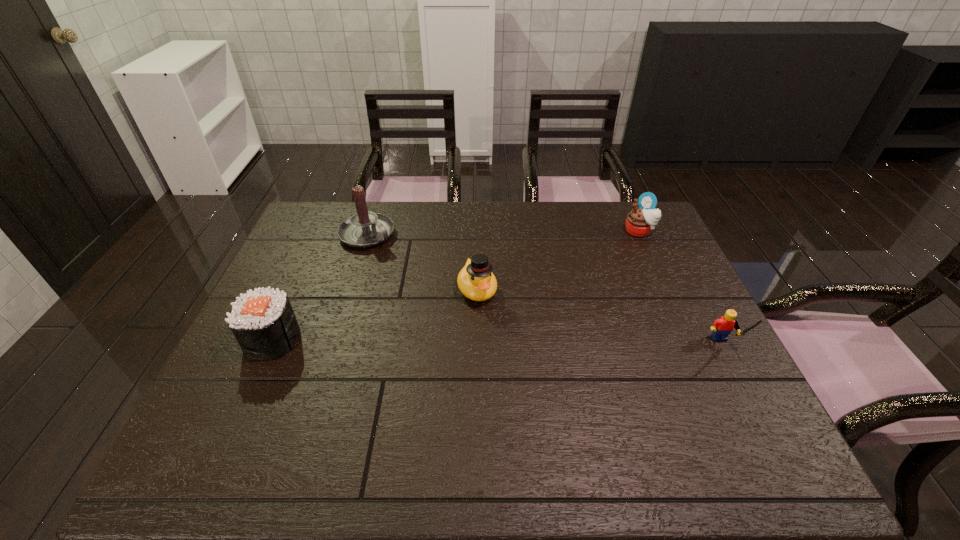
Identify the location of free space on the desktop that is between the sushi and the Lego and is positioned on the front-facing side of the muffin. (530, 343).

I want to click on vacant spot on the desktop that is between the sushi and the Lego and is positioned on the front-facing side of the third object from right to left, so click(x=502, y=343).

In order to click on free space on the desktop that is between the sushi and the Lego and is positioned on the side of the tallest object with the handle loop in this screenshot , I will do `click(518, 343)`.